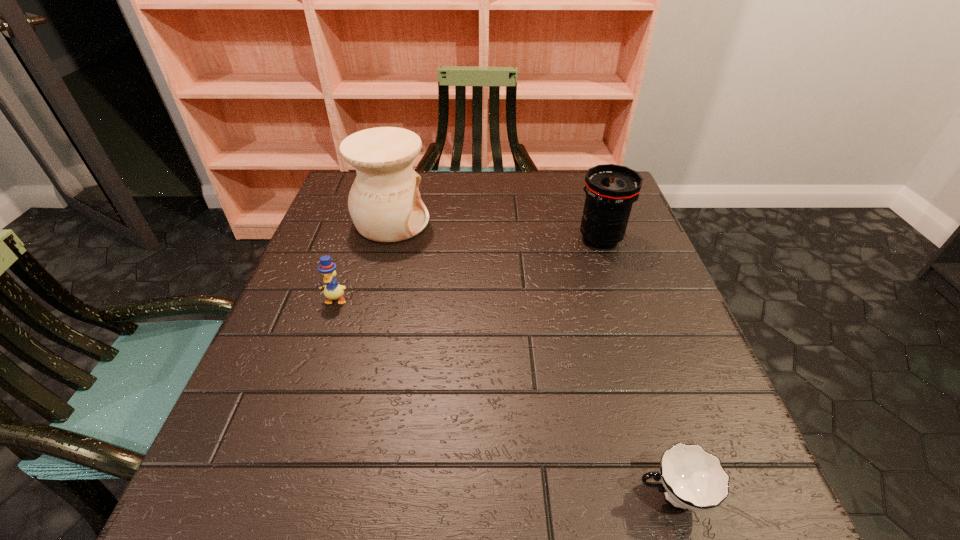
You are a GUI agent. You are given a task and a screenshot of the screen. Output one action in this format:
    pyautogui.click(x=<x>, y=<y>)
    Task: Click on the vacant space that satisfies the following two spatial constraints: 1. on the side of the cup with the handle; 2. on the face of the third tallest object, where the monocle is placed
    
    Given the screenshot: What is the action you would take?
    pyautogui.click(x=611, y=300)

Image resolution: width=960 pixels, height=540 pixels. I want to click on free region that satisfies the following two spatial constraints: 1. on the face of the second shortest object, where the monocle is placed; 2. on the side of the nearest object with the handle, so click(268, 495).

Where is `vacant point that satisfies the following two spatial constraints: 1. on the side of the nearest object with the handle; 2. on the face of the duckling, where the monocle is placed`? vacant point that satisfies the following two spatial constraints: 1. on the side of the nearest object with the handle; 2. on the face of the duckling, where the monocle is placed is located at coordinates (611, 300).

Where is `blank area in the image that satisfies the following two spatial constraints: 1. at the open side of the tallest object; 2. on the side of the nearest object with the handle`? The height and width of the screenshot is (540, 960). blank area in the image that satisfies the following two spatial constraints: 1. at the open side of the tallest object; 2. on the side of the nearest object with the handle is located at coordinates (322, 495).

Locate an element on the screen. vacant position in the image that satisfies the following two spatial constraints: 1. at the open side of the pottery; 2. on the face of the second nearest object, where the monocle is placed is located at coordinates (372, 300).

Where is `free space that satisfies the following two spatial constraints: 1. on the side of the nearest object with the handle; 2. on the face of the duckling, where the monocle is placed`? The height and width of the screenshot is (540, 960). free space that satisfies the following two spatial constraints: 1. on the side of the nearest object with the handle; 2. on the face of the duckling, where the monocle is placed is located at coordinates (611, 300).

Where is `free space that satisfies the following two spatial constraints: 1. at the open side of the telephoto lens; 2. on the right side of the tallest object`? The image size is (960, 540). free space that satisfies the following two spatial constraints: 1. at the open side of the telephoto lens; 2. on the right side of the tallest object is located at coordinates (387, 239).